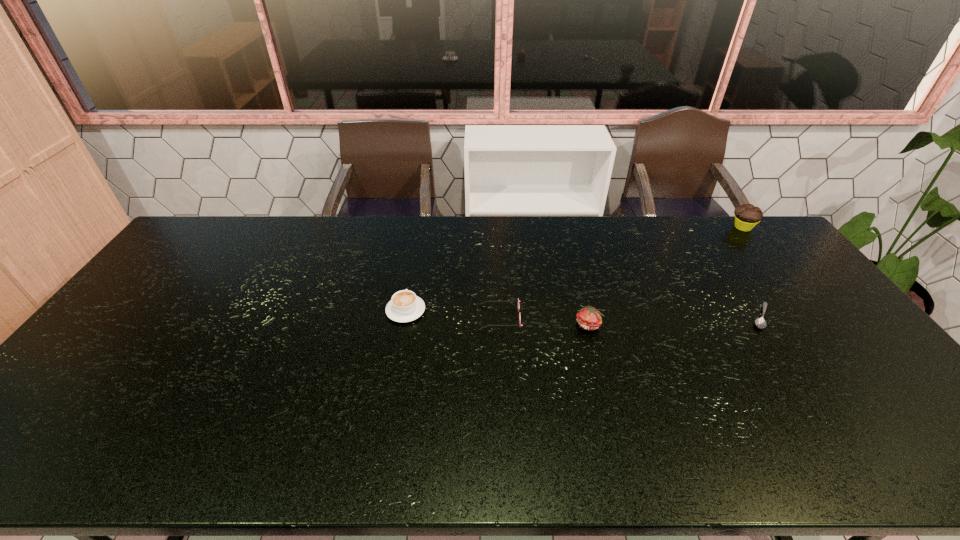
Where is `muffin`? muffin is located at coordinates (747, 216).

Where is `the tallest object`? This screenshot has width=960, height=540. the tallest object is located at coordinates pyautogui.click(x=747, y=216).

At what (x,y) coordinates should I click in order to perform the action: click on the fourth shortest object. Please return your answer as a coordinate pair (x, y). This screenshot has height=540, width=960. Looking at the image, I should click on (589, 318).

The height and width of the screenshot is (540, 960). Find the location of `tomato`. tomato is located at coordinates (589, 318).

Locate an element on the screen. the leftmost object is located at coordinates (404, 306).

Where is `cappuccino`? cappuccino is located at coordinates (404, 306).

Locate an element on the screen. the fourth tallest object is located at coordinates (518, 300).

Image resolution: width=960 pixels, height=540 pixels. I want to click on sunglasses, so click(x=518, y=300).

The image size is (960, 540). What are the coordinates of `the shortest object` in the screenshot? It's located at pyautogui.click(x=760, y=323).

The width and height of the screenshot is (960, 540). Identify the location of the fourth object from left to right. (760, 323).